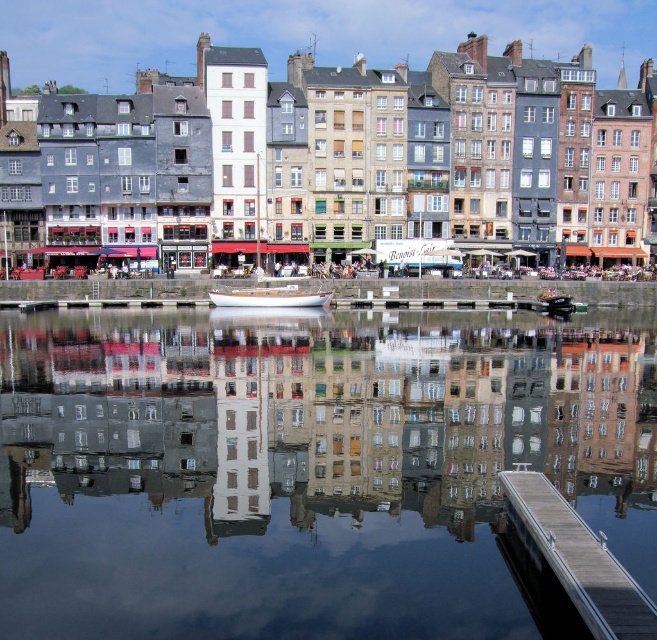
Does smooth water at center appear over wooden dock at lower right?

Yes.

Between point (443, 403) and point (570, 568), which one is positioned behind?

Point (443, 403)

The width and height of the screenshot is (657, 640). What do you see at coordinates (304, 467) in the screenshot?
I see `smooth water at center` at bounding box center [304, 467].

Where is `smooth water at center`? smooth water at center is located at coordinates (304, 467).

How much distance is there between wooden dock at lower right and white wood boat at center?

The distance of wooden dock at lower right from white wood boat at center is 150.48 feet.

Is point (547, 528) positioned in front of point (256, 248)?

Yes, point (547, 528) is closer to viewer.

Where is `wooden dock at lower right`? wooden dock at lower right is located at coordinates (579, 561).

Image resolution: width=657 pixels, height=640 pixels. Identify the location of wooden dock at lower right. (579, 561).

Who is more distant from viewer, (311, 292) or (275, 300)?

Point (311, 292)

Looking at this image, is white wood boat at center wider than white wooden boat at center?

Correct, the width of white wood boat at center exceeds that of white wooden boat at center.

Is point (304, 244) behind point (229, 296)?

Yes, point (304, 244) is behind point (229, 296).

I want to click on white wood boat at center, so click(269, 298).